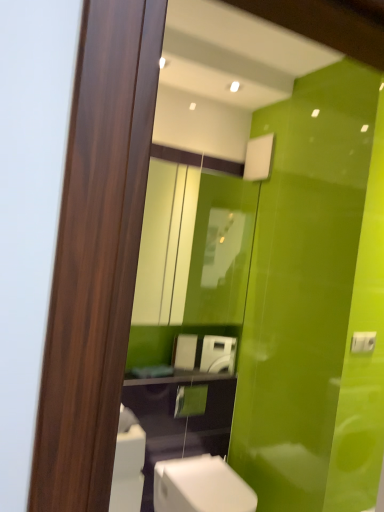
This screenshot has height=512, width=384. Identify the location of free spot above white glossy toilet at lower center (from a real-world perspective). (209, 476).